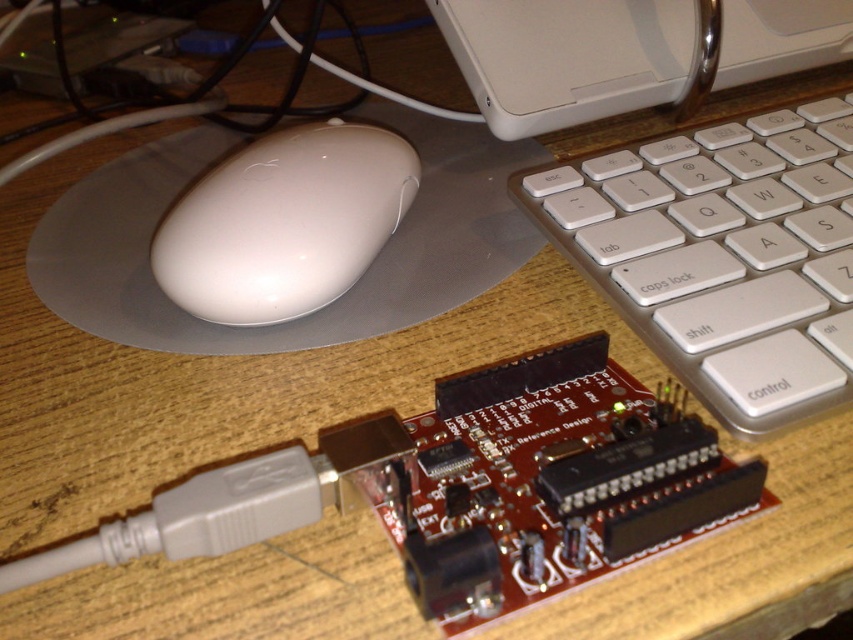
Does white plastic keyboard at center appear on the left side of white glossy mouse at center?

In fact, white plastic keyboard at center is to the right of white glossy mouse at center.

Does point (744, 209) come closer to viewer compared to point (276, 204)?

No, (744, 209) is further to viewer.

Does point (764, 387) come in front of point (265, 236)?

Yes, it is.

Find the location of `white plastic keyboard at center`. white plastic keyboard at center is located at coordinates (723, 256).

Between white glossy mouse at center and white plastic computer at upper center, which one is positioned lower?

white glossy mouse at center is lower down.

From the picture: Is white glossy mouse at center shorter than white plastic computer at upper center?

Yes, white glossy mouse at center is shorter than white plastic computer at upper center.

Measure the distance between point [302,268] and camera.

The distance of point [302,268] from camera is 15.13 inches.

You are a GUI agent. You are given a task and a screenshot of the screen. Output one action in this format:
    pyautogui.click(x=<x>, y=<y>)
    Task: Click on the white glossy mouse at center
    The height and width of the screenshot is (640, 853).
    Given the screenshot: What is the action you would take?
    pyautogui.click(x=283, y=221)

Which is above, white plastic keyboard at center or white plastic computer at upper center?

white plastic computer at upper center is higher up.

Which is in front, point (785, 404) or point (502, 96)?

Positioned in front is point (785, 404).

Locate an element on the screen. This screenshot has height=640, width=853. white plastic keyboard at center is located at coordinates (723, 256).